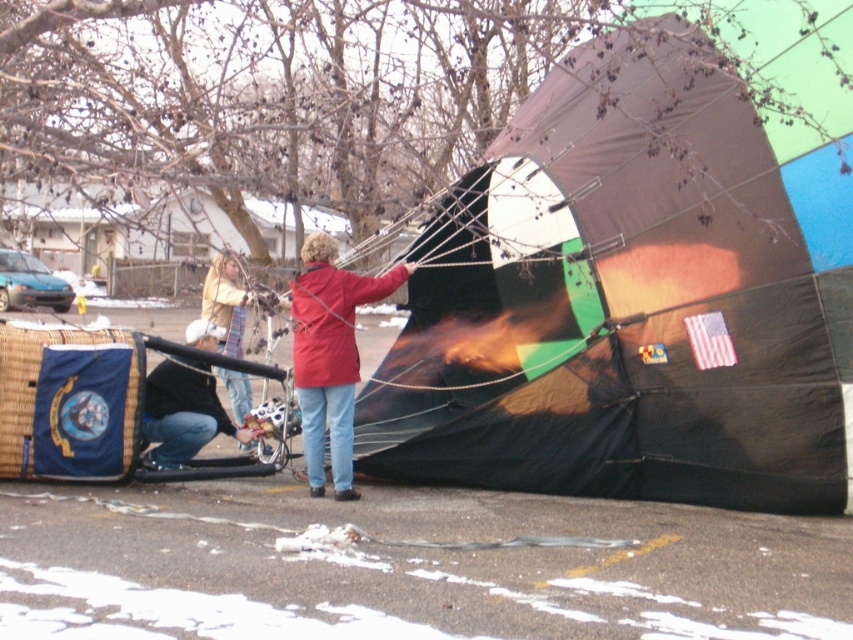
You are standing in the scene and need to determine which object is shorter between the denim jeans at lower left and the striped scarf at center. Can you identify the shorter one?

The denim jeans at lower left has a lesser height compared to the striped scarf at center, so the denim jeans at lower left is shorter.